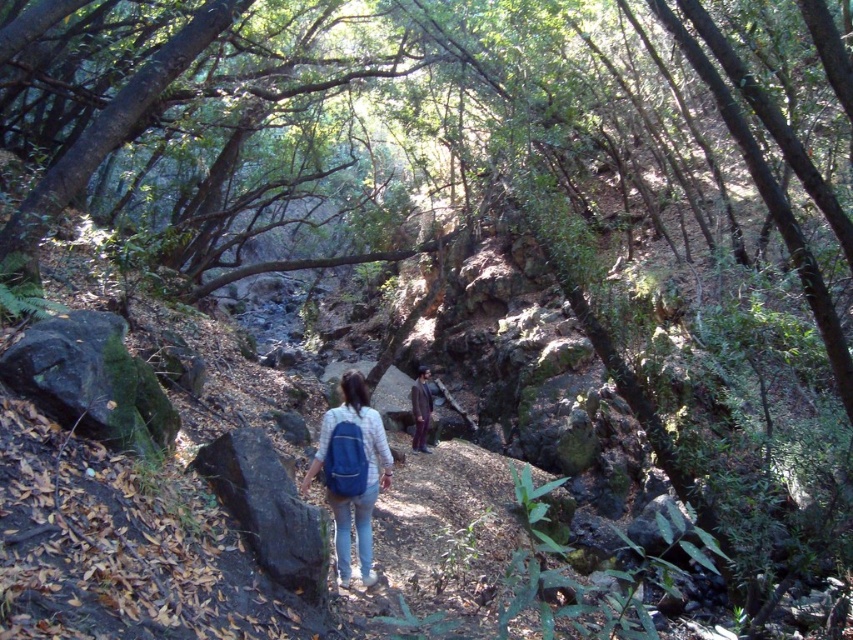
You are standing on the forest path and want to reach the two points marked in the image. Which point, point (338, 412) or point (424, 396), is closer to you?

Point (338, 412) is closer to the camera than point (424, 396), so it is closer to you.

You are a hiker carrying a heavy backpack and you see the black rough rock at center. You want to place your backpack on it. Can you reach it without moving more than 14 feet?

The black rough rock at center is 14.15 feet away from viewer. Since the distance is slightly over 14 feet, you cannot reach it without moving more than 14 feet.